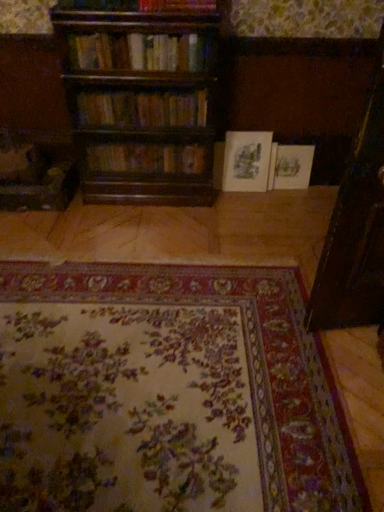
Describe the element at coordinates (246, 161) in the screenshot. The width and height of the screenshot is (384, 512). I see `matte paper book at center, the fourth book viewed from the front` at that location.

I want to click on matte paper book at center, the fourth book viewed from the front, so click(x=246, y=161).

Measure the distance between point [140,69] and camera.

A distance of 7.66 feet exists between point [140,69] and camera.

Locate an element on the screen. wooden bookshelf at center, the 3th book in the back-to-front sequence is located at coordinates (147, 158).

The height and width of the screenshot is (512, 384). What do you see at coordinates (292, 166) in the screenshot? I see `white paper book at center, the 5th book in the front-to-back sequence` at bounding box center [292, 166].

Identify the location of white paper book at center, the 1th book positioned from the back. The height and width of the screenshot is (512, 384). (292, 166).

At what (x,y) coordinates should I click in order to perform the action: click on matte paper book at center, arranged as the second book when viewed from the back. Please return your answer as a coordinate pair (x, y). The height and width of the screenshot is (512, 384). Looking at the image, I should click on (246, 161).

Between white paper book at center, the 5th book in the front-to-back sequence, and floral carpet at center, which one is positioned in front?

floral carpet at center is more forward.

Would you consider white paper book at center, the 1th book positioned from the back, to be distant from floral carpet at center?

Absolutely, white paper book at center, the 1th book positioned from the back, is distant from floral carpet at center.

From the picture: Is white paper book at center, the 1th book positioned from the back, wider or thinner than floral carpet at center?

Considering their sizes, white paper book at center, the 1th book positioned from the back, looks slimmer than floral carpet at center.

Identify the location of mat in front of the white paper book at center, the 1th book positioned from the back. The height and width of the screenshot is (512, 384). click(167, 393).

Is matte paper book at center, arranged as the second book when viewed from the back, in contact with wooden bookshelf at upper center, the first book from the front?

matte paper book at center, arranged as the second book when viewed from the back, and wooden bookshelf at upper center, the first book from the front, are not in contact.

Which is correct: matte paper book at center, arranged as the second book when viewed from the back, is inside wooden bookshelf at upper center, the fifth book viewed from the back, or outside of it?

matte paper book at center, arranged as the second book when viewed from the back, exists outside the volume of wooden bookshelf at upper center, the fifth book viewed from the back.

Considering the sizes of objects matte paper book at center, the fourth book viewed from the front, and wooden bookshelf at upper center, the fifth book viewed from the back, in the image provided, who is smaller, matte paper book at center, the fourth book viewed from the front, or wooden bookshelf at upper center, the fifth book viewed from the back,?

matte paper book at center, the fourth book viewed from the front, is smaller.

Considering the sizes of matte paper book at center, the fourth book viewed from the front, and wooden bookshelf at upper center, the first book from the front, in the image, is matte paper book at center, the fourth book viewed from the front, wider or thinner than wooden bookshelf at upper center, the first book from the front,?

Clearly, matte paper book at center, the fourth book viewed from the front, has less width compared to wooden bookshelf at upper center, the first book from the front.

Consider the image. From a real-world perspective, is wooden bookshelf at center, which appears as the third book when viewed from the front, positioned over floral carpet at center based on gravity?

Correct, in the physical world, wooden bookshelf at center, which appears as the third book when viewed from the front, is higher than floral carpet at center.

Which object is more forward, wooden bookshelf at center, which appears as the third book when viewed from the front, or floral carpet at center?

floral carpet at center is more forward.

Which object is thinner, wooden bookshelf at center, which appears as the third book when viewed from the front, or floral carpet at center?

With smaller width is wooden bookshelf at center, which appears as the third book when viewed from the front.

Is floral carpet at center at the back of wooden bookshelf at center, which appears as the third book when viewed from the front?

wooden bookshelf at center, which appears as the third book when viewed from the front, is not turned away from floral carpet at center.

Considering the relative sizes of floral carpet at center and wooden bookshelf at upper center, the first book from the front, in the image provided, is floral carpet at center shorter than wooden bookshelf at upper center, the first book from the front,?

Yes.

Does point (131, 395) lie in front of point (147, 35)?

Yes, point (131, 395) is in front of point (147, 35).

Is there a large distance between floral carpet at center and wooden bookshelf at upper center, the first book from the front?

Indeed, floral carpet at center is not near wooden bookshelf at upper center, the first book from the front.

Is wooden bookshelf at center, placed as the 4th book when sorted from back to front, wider than wooden bookshelf at upper center, the first book from the front?

Indeed, wooden bookshelf at center, placed as the 4th book when sorted from back to front, has a greater width compared to wooden bookshelf at upper center, the first book from the front.

Can we say wooden bookshelf at center, marked as the second book in a front-to-back arrangement, lies outside wooden bookshelf at upper center, the first book from the front?

Yes, wooden bookshelf at center, marked as the second book in a front-to-back arrangement, is not within wooden bookshelf at upper center, the first book from the front.

Is wooden bookshelf at center, marked as the second book in a front-to-back arrangement, placed right next to wooden bookshelf at upper center, the fifth book viewed from the back?

No, wooden bookshelf at center, marked as the second book in a front-to-back arrangement, is not next to wooden bookshelf at upper center, the fifth book viewed from the back.

Is wooden bookshelf at center, marked as the second book in a front-to-back arrangement, oriented away from wooden bookshelf at upper center, the fifth book viewed from the back?

No, wooden bookshelf at center, marked as the second book in a front-to-back arrangement, is not facing away from wooden bookshelf at upper center, the fifth book viewed from the back.

Would you say wooden bookshelf at center, placed as the 4th book when sorted from back to front, is inside or outside wooden bookshelf at center, the 3th book in the back-to-front sequence?

wooden bookshelf at center, placed as the 4th book when sorted from back to front, is outside wooden bookshelf at center, the 3th book in the back-to-front sequence.

From the picture: Is wooden bookshelf at center, marked as the second book in a front-to-back arrangement, turned away from wooden bookshelf at center, which appears as the third book when viewed from the front?

wooden bookshelf at center, marked as the second book in a front-to-back arrangement, is not turned away from wooden bookshelf at center, which appears as the third book when viewed from the front.

Between point (123, 124) and point (125, 153), which one is positioned in front?

The point (123, 124) is more forward.

Considering the points (169, 65) and (262, 135), which point is behind, point (169, 65) or point (262, 135)?

The point (262, 135) is farther.

Measure the distance between wooden bookshelf at upper center, the first book from the front, and matte paper book at center, the fourth book viewed from the front.

wooden bookshelf at upper center, the first book from the front, is 79.70 centimeters away from matte paper book at center, the fourth book viewed from the front.

Considering the relative sizes of wooden bookshelf at upper center, the fifth book viewed from the back, and matte paper book at center, arranged as the second book when viewed from the back, in the image provided, is wooden bookshelf at upper center, the fifth book viewed from the back, bigger than matte paper book at center, arranged as the second book when viewed from the back,?

Yes.

Starting from the floral carpet at center, which book is the 5th one behind? Please provide its 2D coordinates.

[(292, 166)]

The height and width of the screenshot is (512, 384). I want to click on book that is the 3rd object to the left of the matte paper book at center, arranged as the second book when viewed from the back, starting at the anchor, so click(139, 52).

When comparing their distances from white paper book at center, the 5th book in the front-to-back sequence, does wooden bookshelf at upper center, the fifth book viewed from the back, or wooden bookshelf at center, the 3th book in the back-to-front sequence, seem closer?

wooden bookshelf at center, the 3th book in the back-to-front sequence, is closer to white paper book at center, the 5th book in the front-to-back sequence.

When comparing their distances from white paper book at center, the 1th book positioned from the back, does wooden bookshelf at upper center, the first book from the front, or wooden bookshelf at center, marked as the second book in a front-to-back arrangement, seem further?

The object further to white paper book at center, the 1th book positioned from the back, is wooden bookshelf at upper center, the first book from the front.

Considering their positions, is wooden bookshelf at center, placed as the 4th book when sorted from back to front, positioned further to floral carpet at center than white paper book at center, the 5th book in the front-to-back sequence?

white paper book at center, the 5th book in the front-to-back sequence, is positioned further to the anchor floral carpet at center.

Which object lies further to the anchor point floral carpet at center, matte paper book at center, arranged as the second book when viewed from the back, or wooden bookshelf at upper center, the first book from the front?

wooden bookshelf at upper center, the first book from the front, is further to floral carpet at center.

When comparing their distances from white paper book at center, the 5th book in the front-to-back sequence, does wooden bookshelf at center, the 3th book in the back-to-front sequence, or wooden bookshelf at upper center, the fifth book viewed from the back, seem further?

Among the two, wooden bookshelf at upper center, the fifth book viewed from the back, is located further to white paper book at center, the 5th book in the front-to-back sequence.

Looking at the image, which one is located further to matte paper book at center, the fourth book viewed from the front, wooden bookshelf at center, the 3th book in the back-to-front sequence, or white paper book at center, the 1th book positioned from the back?

The object further to matte paper book at center, the fourth book viewed from the front, is wooden bookshelf at center, the 3th book in the back-to-front sequence.

Considering their positions, is white paper book at center, the 5th book in the front-to-back sequence, positioned closer to wooden bookshelf at center, which appears as the third book when viewed from the front, than floral carpet at center?

white paper book at center, the 5th book in the front-to-back sequence, lies closer to wooden bookshelf at center, which appears as the third book when viewed from the front, than the other object.

Based on their spatial positions, is white paper book at center, the 1th book positioned from the back, or wooden bookshelf at upper center, the first book from the front, further from matte paper book at center, the fourth book viewed from the front?

wooden bookshelf at upper center, the first book from the front, is further to matte paper book at center, the fourth book viewed from the front.

Where is `book between wooden bookshelf at center, marked as the second book in a front-to-back arrangement, and white paper book at center, the 5th book in the front-to-back sequence, in the horizontal direction`? book between wooden bookshelf at center, marked as the second book in a front-to-back arrangement, and white paper book at center, the 5th book in the front-to-back sequence, in the horizontal direction is located at coordinates (246, 161).

You are a GUI agent. You are given a task and a screenshot of the screen. Output one action in this format:
    pyautogui.click(x=<x>, y=<y>)
    Task: Click on the book between wooden bookshelf at upper center, the fifth book viewed from the back, and wooden bookshelf at center, which appears as the third book when viewed from the front, in the up-down direction
    The image size is (384, 512).
    Given the screenshot: What is the action you would take?
    pyautogui.click(x=142, y=109)

At what (x,y) coordinates should I click in order to perform the action: click on book between wooden bookshelf at center, the 3th book in the back-to-front sequence, and matte paper book at center, arranged as the second book when viewed from the back. Please return your answer as a coordinate pair (x, y). This screenshot has width=384, height=512. Looking at the image, I should click on (142, 109).